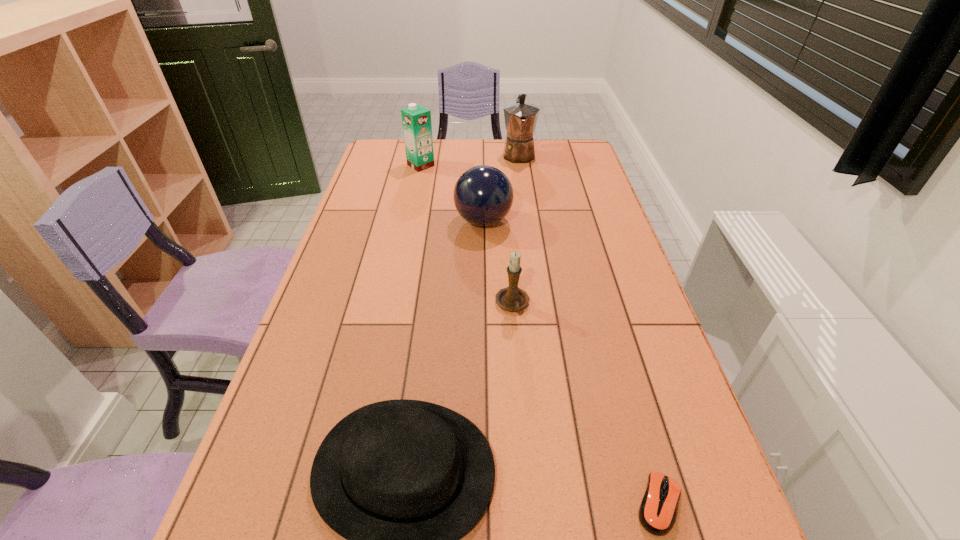
Locate an element on the screen. free region located 0.280m on the surface of the third farthest object near the finger holes is located at coordinates (368, 221).

What are the coordinates of `blank area located on the side of the fourth farthest object with the handle` in the screenshot? It's located at (x=516, y=360).

This screenshot has height=540, width=960. What are the coordinates of `vacant space situated on the left of the rightmost object` in the screenshot? It's located at (452, 504).

This screenshot has height=540, width=960. I want to click on coffeepot that is at the far edge, so click(x=521, y=118).

Where is `carton that is at the far edge`? The height and width of the screenshot is (540, 960). carton that is at the far edge is located at coordinates (416, 120).

This screenshot has height=540, width=960. Identify the location of object at the left edge. (416, 120).

Identify the location of object that is positioned at the right edge. Image resolution: width=960 pixels, height=540 pixels. (658, 509).

The image size is (960, 540). In order to click on object that is positioned at the far left corner in this screenshot , I will do `click(416, 120)`.

Identify the location of vacant space at the left edge of the desktop. The height and width of the screenshot is (540, 960). (379, 289).

Where is `vacant region at the right edge of the desktop`? The height and width of the screenshot is (540, 960). vacant region at the right edge of the desktop is located at coordinates (566, 173).